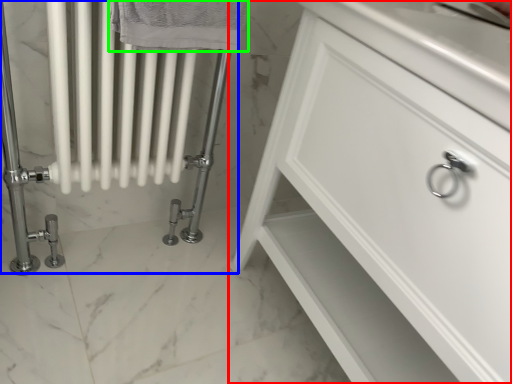
Question: Considering the real-world distances, which object is closest to bathroom cabinet (highlighted by a red box)? bath (highlighted by a blue box) or bath towel (highlighted by a green box).

Choices:
 (A) bath
 (B) bath towel

Answer: (A)